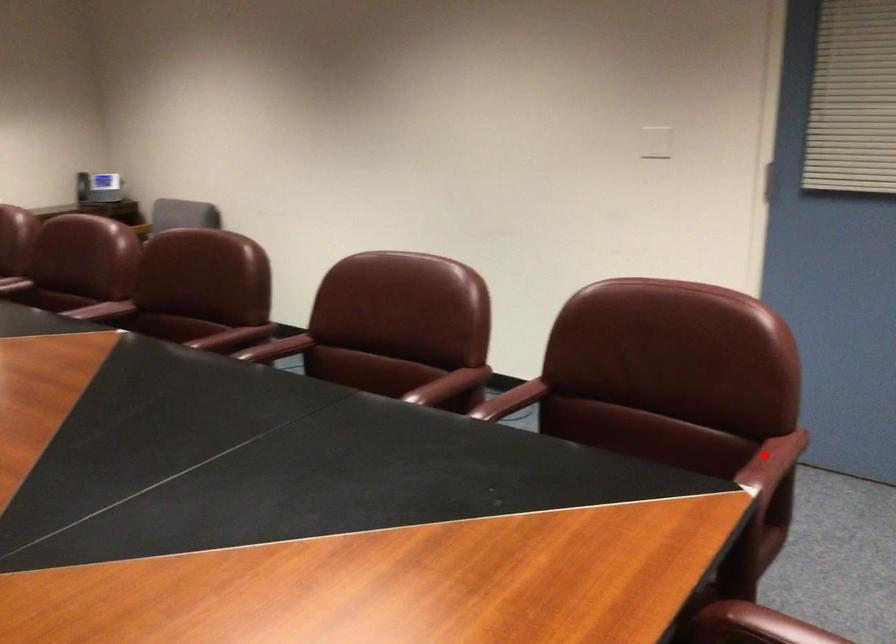
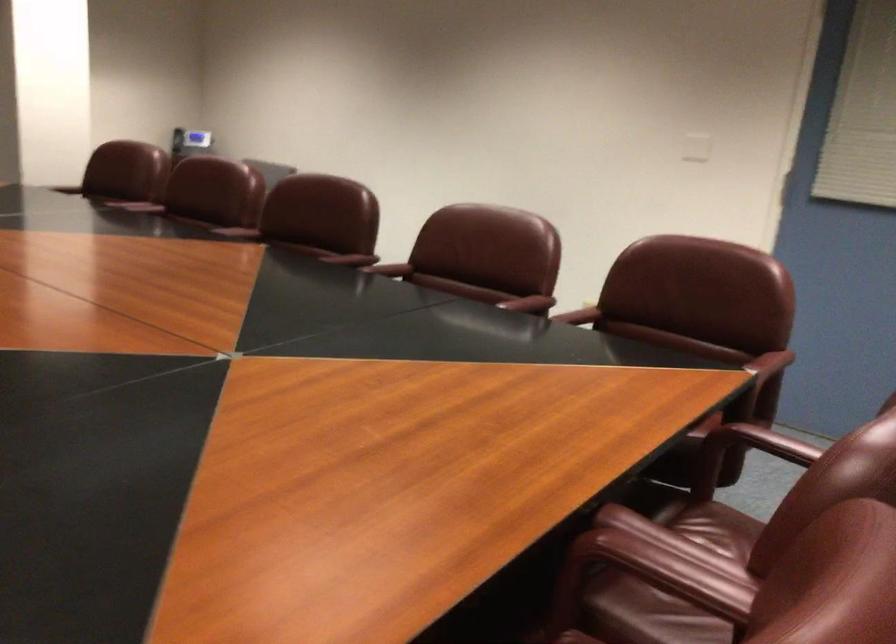
Question: I am providing you with two images of the same scene from different viewpoints. In image1, a red point is highlighted. Considering the same 3D point in image2, which of the following is correct?

Choices:
 (A) It is closer
 (B) It is farther

Answer: (B)